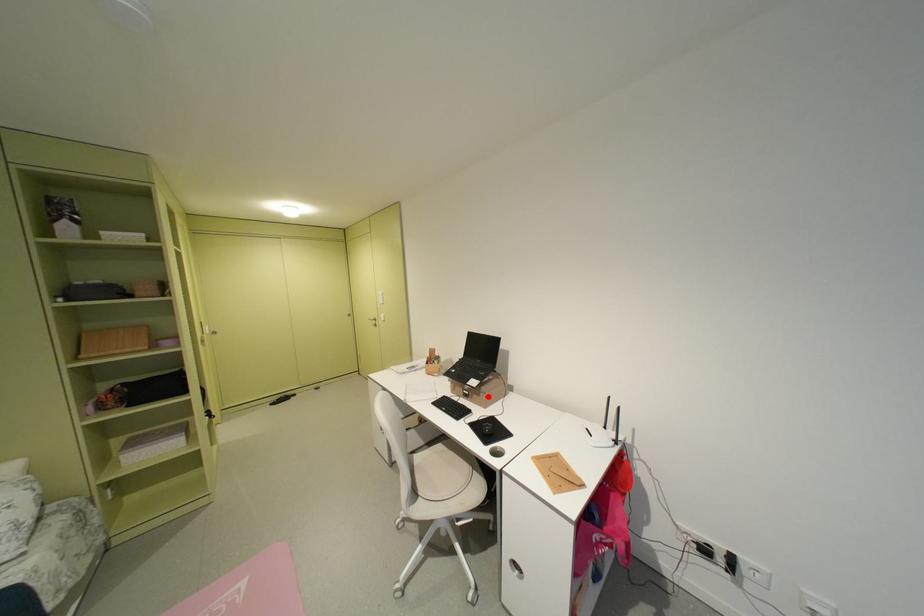
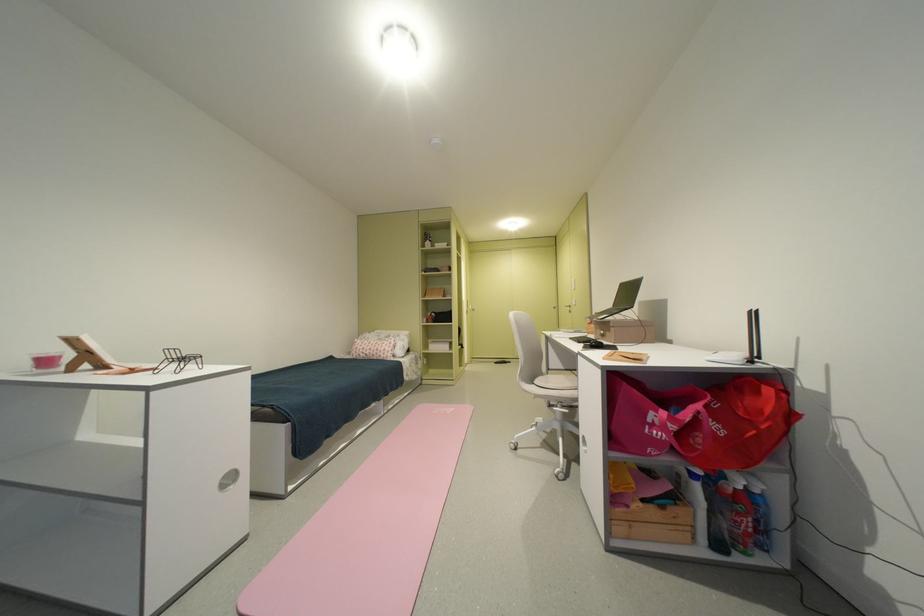
Question: A red point is marked in image1. In image2, is the corresponding 3D point closer to the camera or farther? Reply with the corresponding letter.

Choices:
 (A) The corresponding 3D point is closer.
 (B) The corresponding 3D point is farther.

Answer: (A)